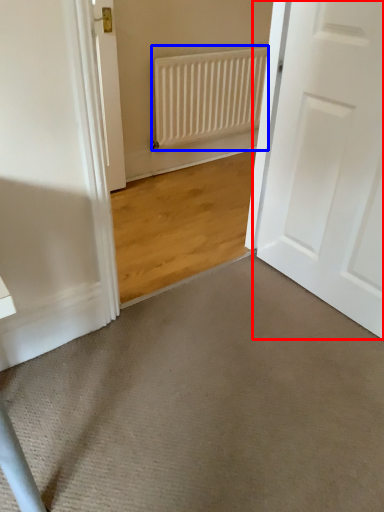
Question: Among these objects, which one is farthest to the camera, door (highlighted by a red box) or radiator (highlighted by a blue box)?

Choices:
 (A) door
 (B) radiator

Answer: (B)